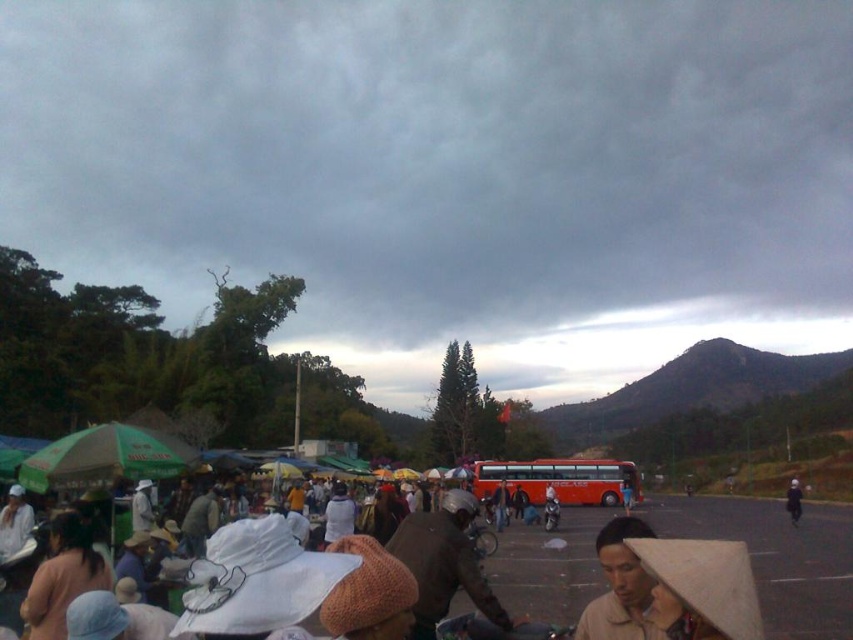
Is point (569, 465) positioned before point (502, 500)?

No, it is behind (502, 500).

Is orange matte bus at center in front of brown leather jacket at center?

No, it is behind brown leather jacket at center.

At what (x,y) coordinates should I click in order to perform the action: click on orange matte bus at center. Please return your answer as a coordinate pair (x, y). Looking at the image, I should click on (558, 480).

Which is below, brown fabric hat at center or white fabric hat at center?

Positioned lower is white fabric hat at center.

Does brown fabric hat at center appear under white fabric hat at center?

Actually, brown fabric hat at center is above white fabric hat at center.

Does point (447, 493) come farther from viewer compared to point (787, 493)?

That is False.

I want to click on brown fabric hat at center, so click(x=444, y=563).

Between brown leather jacket at center and metallic silver motorcycle at center, which one has less height?

With less height is brown leather jacket at center.

Which is above, brown leather jacket at center or metallic silver motorcycle at center?

metallic silver motorcycle at center

Is point (500, 515) positioned after point (552, 529)?

Yes, it is.

What are the coordinates of `brown leather jacket at center` in the screenshot? It's located at (500, 506).